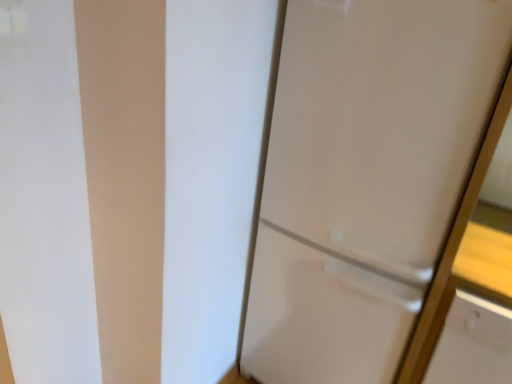
Describe the element at coordinates (385, 197) in the screenshot. I see `white glossy refrigerator at center` at that location.

Find the location of a particular element. Image resolution: width=512 pixels, height=384 pixels. white glossy refrigerator at center is located at coordinates (385, 197).

Measure the distance between white glossy refrigerator at center and camera.

white glossy refrigerator at center is 36.83 inches from camera.

In order to face white glossy refrigerator at center, should I rotate leftwards or rightwards?

Rotate your view right by about 14.635°.

Locate an element on the screen. white glossy refrigerator at center is located at coordinates point(385,197).